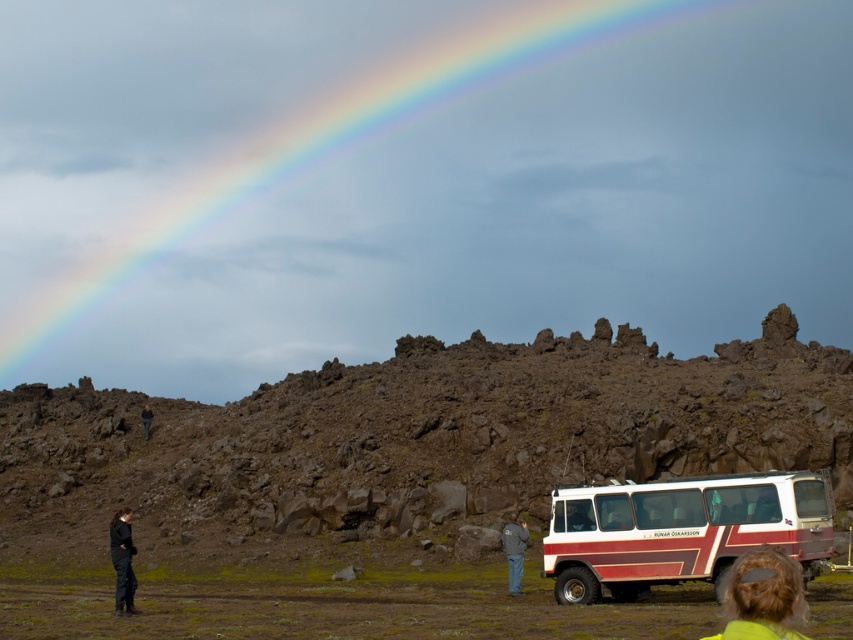
Is point (521, 545) closer to camera compared to point (148, 412)?

Yes, point (521, 545) is in front of point (148, 412).

Who is more forward, (508,540) or (142,417)?

Point (508,540) is more forward.

The width and height of the screenshot is (853, 640). I want to click on denim jacket at lower center, so click(514, 550).

Between point (755, 589) and point (523, 538), which one is positioned in front?

Positioned in front is point (755, 589).

Where is `light brown hair at lower right`? The image size is (853, 640). light brown hair at lower right is located at coordinates (763, 596).

Which is more to the right, rainbow at upper center or black fabric jacket at lower left?

rainbow at upper center

Is rainbow at upper center taller than black fabric jacket at lower left?

Correct, rainbow at upper center is much taller as black fabric jacket at lower left.

This screenshot has width=853, height=640. I want to click on rainbow at upper center, so click(410, 179).